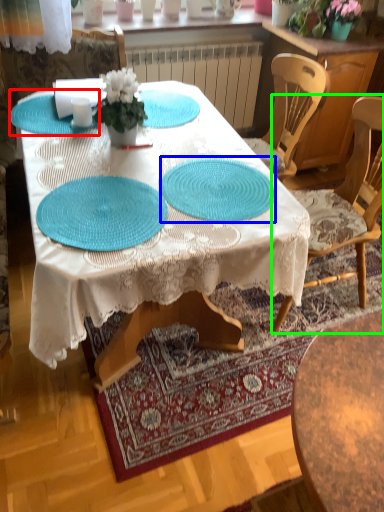
Question: Considering the real-world distances, which object is farthest from glass plate (highlighted by a red box)? glass plate (highlighted by a blue box) or chair (highlighted by a green box)?

Choices:
 (A) glass plate
 (B) chair

Answer: (B)